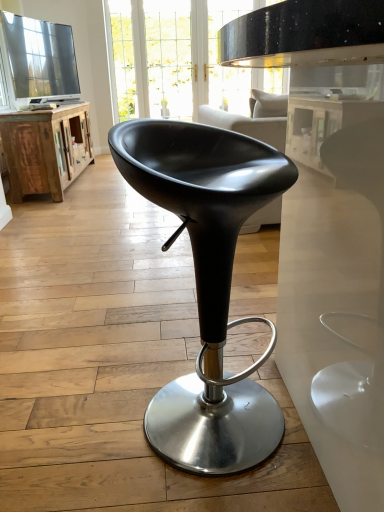
Question: Can you confirm if black leather stool at center is bigger than clear glass door at upper center?

Choices:
 (A) yes
 (B) no

Answer: (A)

Question: From the image's perspective, is black leather stool at center above clear glass door at upper center?

Choices:
 (A) yes
 (B) no

Answer: (B)

Question: Considering the relative sizes of black leather stool at center and clear glass door at upper center in the image provided, is black leather stool at center wider than clear glass door at upper center?

Choices:
 (A) no
 (B) yes

Answer: (B)

Question: From the image's perspective, would you say black leather stool at center is shown under clear glass door at upper center?

Choices:
 (A) no
 (B) yes

Answer: (B)

Question: Is clear glass door at upper center surrounded by black leather stool at center?

Choices:
 (A) no
 (B) yes

Answer: (A)

Question: Is black leather stool at center far from clear glass door at upper center?

Choices:
 (A) no
 (B) yes

Answer: (B)

Question: Is rustic wood cabinet at left oriented towards black leather stool at center?

Choices:
 (A) yes
 (B) no

Answer: (B)

Question: Is there a large distance between rustic wood cabinet at left and black leather stool at center?

Choices:
 (A) yes
 (B) no

Answer: (A)

Question: From the image's perspective, does rustic wood cabinet at left appear lower than black leather stool at center?

Choices:
 (A) no
 (B) yes

Answer: (A)

Question: From a real-world perspective, is rustic wood cabinet at left under black leather stool at center?

Choices:
 (A) yes
 (B) no

Answer: (A)

Question: Considering the relative sizes of rustic wood cabinet at left and black leather stool at center in the image provided, is rustic wood cabinet at left thinner than black leather stool at center?

Choices:
 (A) yes
 (B) no

Answer: (B)

Question: Is black leather stool at center a part of rustic wood cabinet at left?

Choices:
 (A) no
 (B) yes

Answer: (A)

Question: Can you confirm if clear glass door at upper center is positioned to the right of black leather stool at center?

Choices:
 (A) no
 (B) yes

Answer: (A)